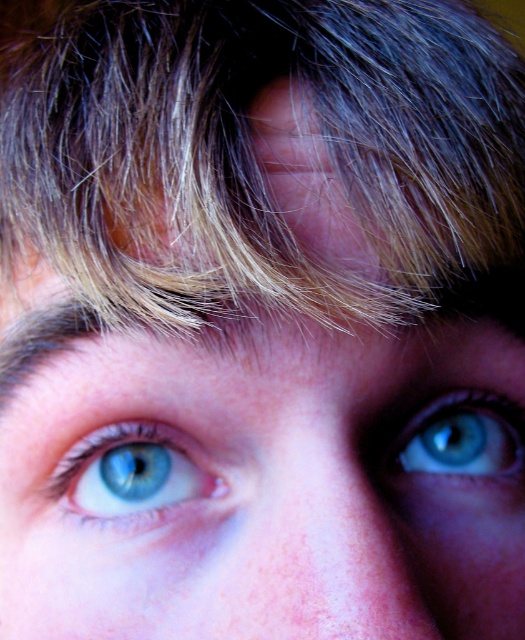
Is blue glossy eye at center closer to the viewer compared to blue glossy eye at upper right?

Yes, it is in front of blue glossy eye at upper right.

Does blue glossy eye at center appear over blue glossy eye at upper right?

Actually, blue glossy eye at center is below blue glossy eye at upper right.

Is point (142, 472) closer to camera compared to point (483, 467)?

Yes, point (142, 472) is in front of point (483, 467).

Identify the location of blue glossy eye at center. The image size is (525, 640). (133, 474).

Is blonde hair at upper center to the left of blue glossy eye at center from the viewer's perspective?

No, blonde hair at upper center is not to the left of blue glossy eye at center.

Is blonde hair at upper center to the right of blue glossy eye at center from the viewer's perspective?

Correct, you'll find blonde hair at upper center to the right of blue glossy eye at center.

Is point (97, 145) behind point (142, 472)?

No, (97, 145) is in front of (142, 472).

At what (x,y) coordinates should I click in order to perform the action: click on blonde hair at upper center. Please return your answer as a coordinate pair (x, y). Looking at the image, I should click on (257, 160).

Which is more to the right, blonde hair at upper center or blue glossy eye at upper right?

blue glossy eye at upper right

Measure the distance between blonde hair at upper center and camera.

blonde hair at upper center and camera are 8.69 inches apart from each other.

Identify the location of blonde hair at upper center. The width and height of the screenshot is (525, 640). (257, 160).

Where is `blonde hair at upper center`? This screenshot has width=525, height=640. blonde hair at upper center is located at coordinates (257, 160).